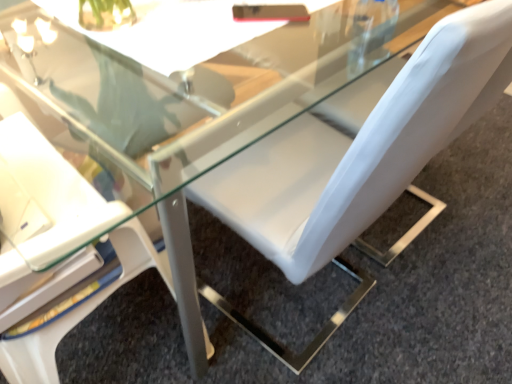
Question: From a real-world perspective, is white leather chair at upper right, which appears as the 2th chair when viewed from the right, above or below white leather chair at center, the 2th chair when ordered from left to right?

Choices:
 (A) above
 (B) below

Answer: (B)

Question: Is point (72, 319) positioned closer to the camera than point (337, 221)?

Choices:
 (A) closer
 (B) farther

Answer: (B)

Question: Considering the relative positions of white leather chair at upper right, which appears as the 2th chair when viewed from the right, and white leather chair at center, acting as the 1th chair starting from the right, in the image provided, is white leather chair at upper right, which appears as the 2th chair when viewed from the right, to the left or to the right of white leather chair at center, acting as the 1th chair starting from the right,?

Choices:
 (A) right
 (B) left

Answer: (B)

Question: Considering their positions, is white leather chair at center, the 2th chair when ordered from left to right, located in front of or behind white leather chair at upper right, the first chair from the left?

Choices:
 (A) behind
 (B) front

Answer: (A)

Question: From the image's perspective, is white leather chair at center, the 2th chair when ordered from left to right, above or below white leather chair at upper right, which appears as the 2th chair when viewed from the right?

Choices:
 (A) above
 (B) below

Answer: (A)

Question: Considering the relative positions of white leather chair at center, the 2th chair when ordered from left to right, and white leather chair at upper right, which appears as the 2th chair when viewed from the right, in the image provided, is white leather chair at center, the 2th chair when ordered from left to right, to the left or to the right of white leather chair at upper right, which appears as the 2th chair when viewed from the right,?

Choices:
 (A) right
 (B) left

Answer: (A)

Question: Choose the correct answer: Is white leather chair at center, the 2th chair when ordered from left to right, inside white leather chair at upper right, which appears as the 2th chair when viewed from the right, or outside it?

Choices:
 (A) outside
 (B) inside

Answer: (A)